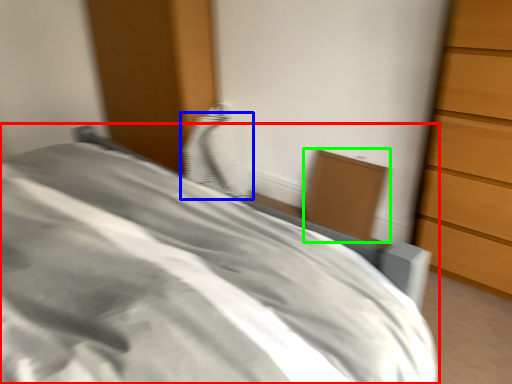
Question: Which object is positioned farthest from bed (highlighted by a red box)? Select from pillow (highlighted by a blue box) and cabinetry (highlighted by a green box).

Choices:
 (A) pillow
 (B) cabinetry

Answer: (A)